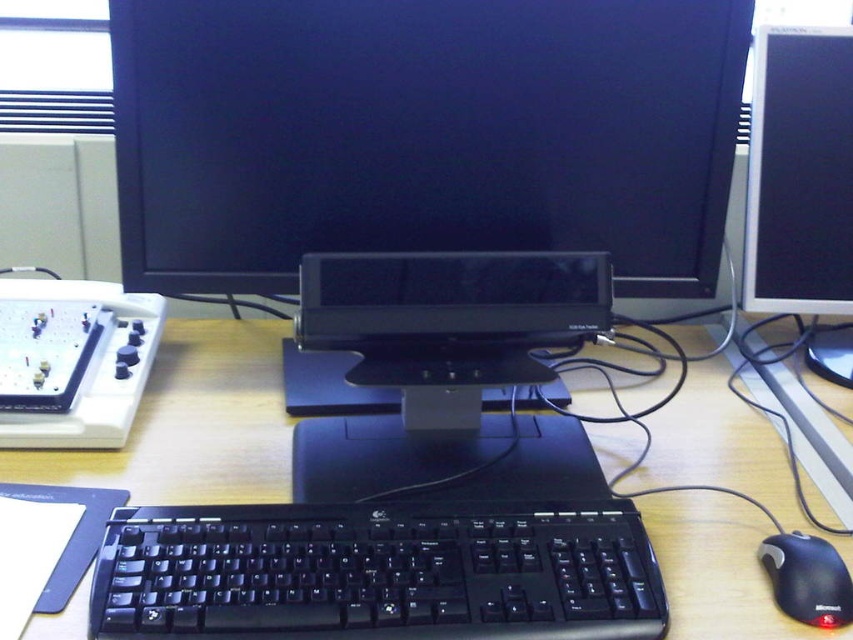
Question: Can you confirm if wooden desk at center is bigger than black plastic mouse at lower right?

Choices:
 (A) yes
 (B) no

Answer: (A)

Question: Which object is closer to the camera taking this photo?

Choices:
 (A) wooden desk at center
 (B) black plastic monitor at center

Answer: (A)

Question: Which point is farther from the camera taking this photo?

Choices:
 (A) (827, 202)
 (B) (276, 170)
 (C) (115, 621)

Answer: (A)

Question: Does black plastic keyboard at center appear under black plastic mouse at lower right?

Choices:
 (A) yes
 (B) no

Answer: (B)

Question: Is black glossy monitor at center smaller than wooden desk at center?

Choices:
 (A) yes
 (B) no

Answer: (A)

Question: Which point appears farthest from the camera in this image?

Choices:
 (A) click(x=850, y=45)
 (B) click(x=610, y=461)
 (C) click(x=518, y=161)

Answer: (A)